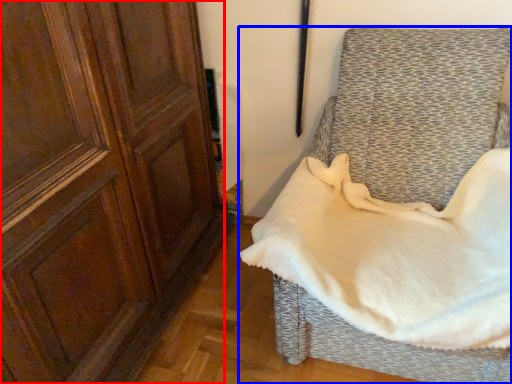
Question: Which of the following is the farthest to the observer, screen door (highlighted by a red box) or furniture (highlighted by a blue box)?

Choices:
 (A) screen door
 (B) furniture

Answer: (B)